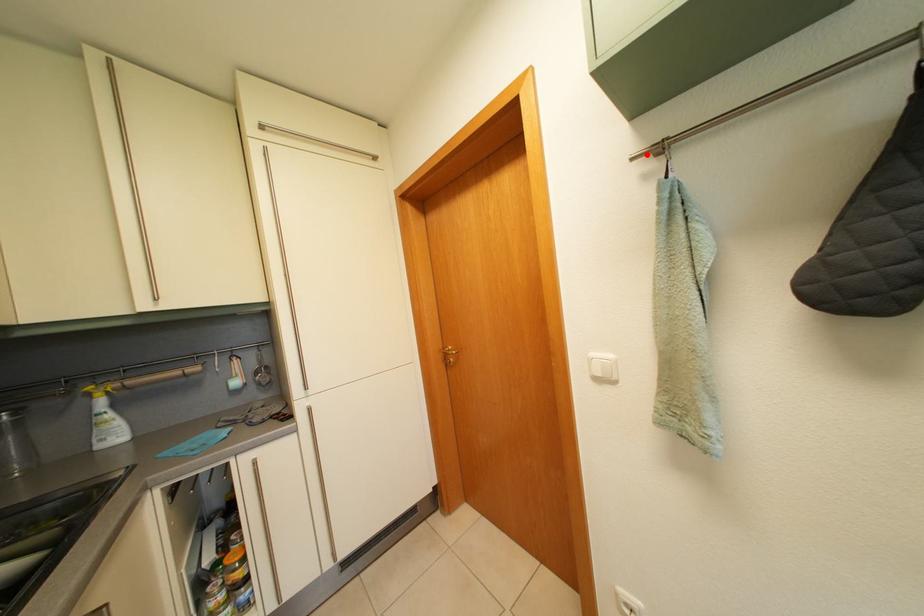
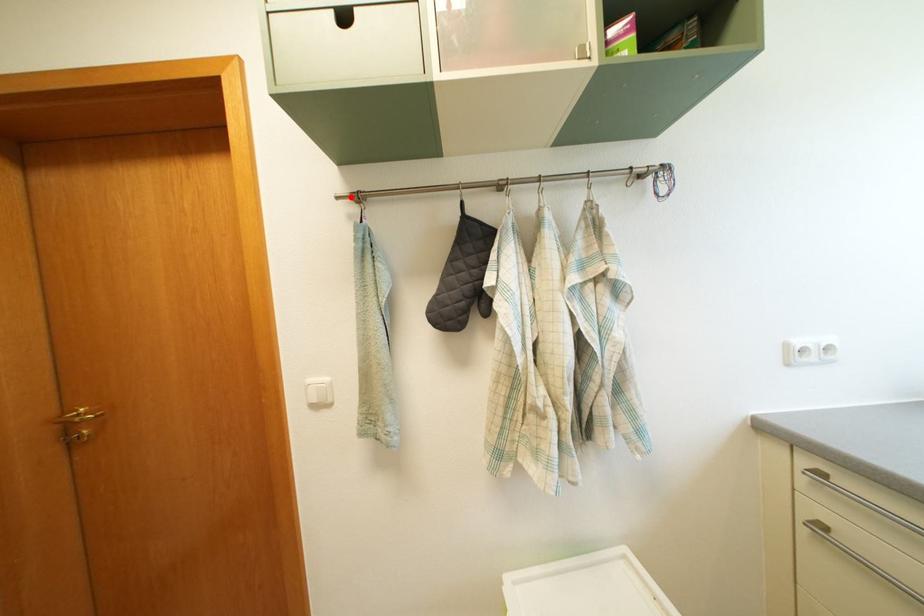
I am providing you with two images of the same scene from different viewpoints. A red point is marked on the first image and another point is marked on the second image. Does the point marked in image1 correspond to the same location as the one in image2?

Yes